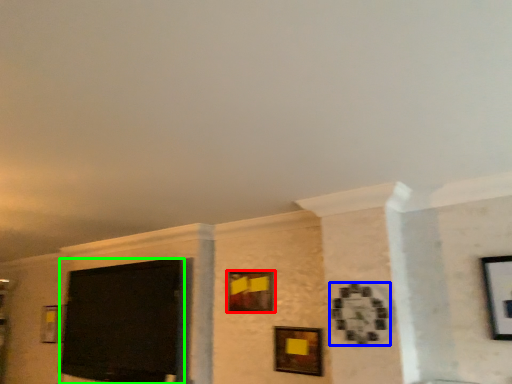
Question: Based on their relative distances, which object is nearer to picture frame (highlighted by a red box)? Choose from picture frame (highlighted by a blue box) and projection screen (highlighted by a green box).

Choices:
 (A) picture frame
 (B) projection screen

Answer: (A)